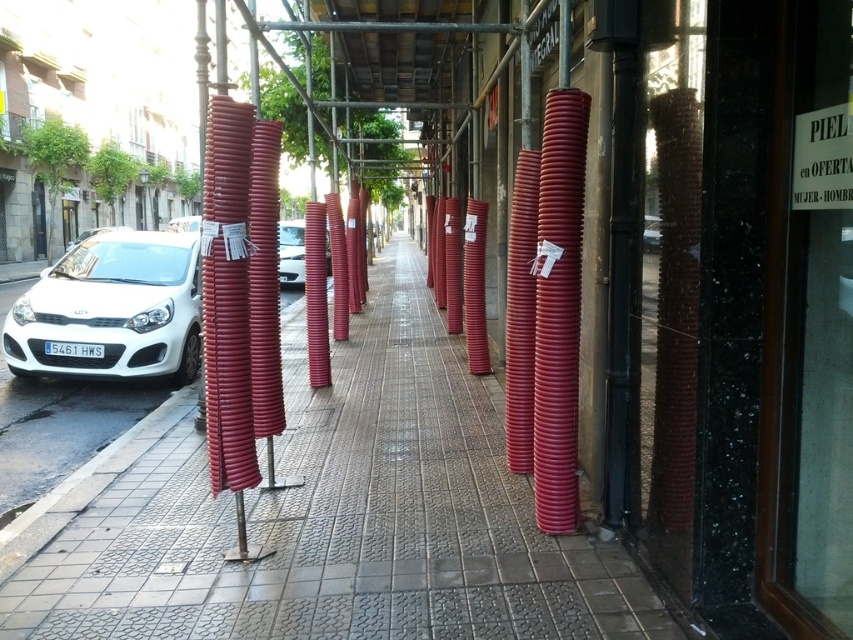
Question: Is white glossy car at center smaller than white glossy car at left?

Choices:
 (A) no
 (B) yes

Answer: (B)

Question: Which of these objects is positioned closest to the smooth concrete pavement at center?

Choices:
 (A) metallic silver car at center
 (B) white matte car at left
 (C) white glossy car at center
 (D) white glossy car at left

Answer: (A)

Question: Estimate the real-world distances between objects in this image. Which object is farther from the metallic silver car at center?

Choices:
 (A) smooth concrete pavement at center
 (B) white glossy car at center

Answer: (B)

Question: Does white matte car at left have a larger size compared to metallic silver car at center?

Choices:
 (A) yes
 (B) no

Answer: (A)

Question: Can you confirm if white matte car at left is positioned to the right of white glossy car at center?

Choices:
 (A) no
 (B) yes

Answer: (A)

Question: Estimate the real-world distances between objects in this image. Which object is farther from the smooth concrete pavement at center?

Choices:
 (A) white glossy car at center
 (B) white matte car at left

Answer: (A)